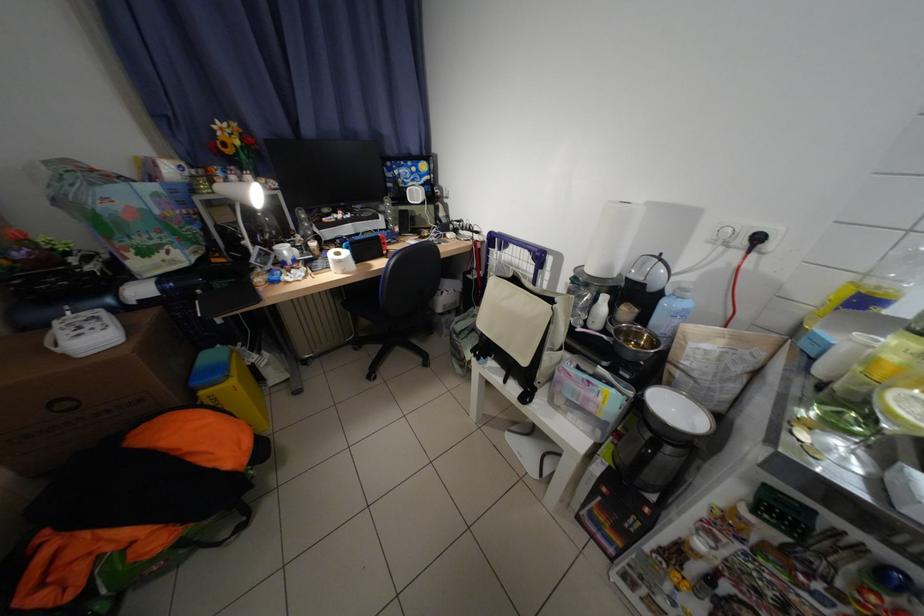
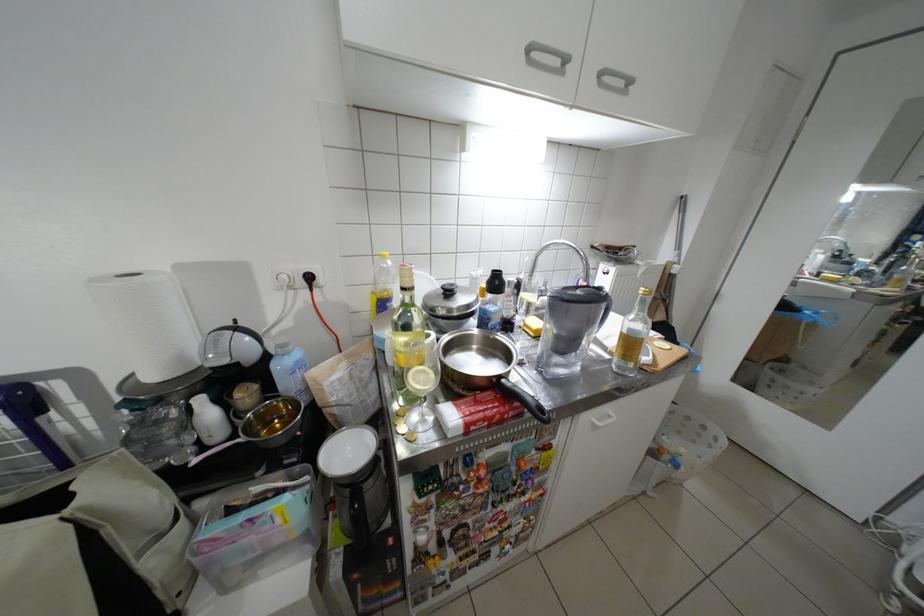
Find the pixel in the second image that matches (x=602, y=272) in the first image.

(164, 378)